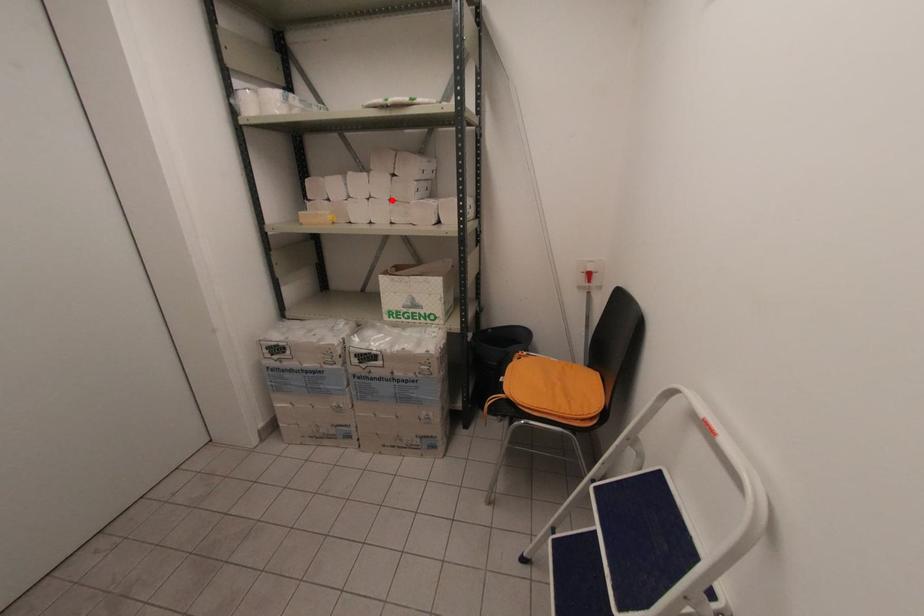
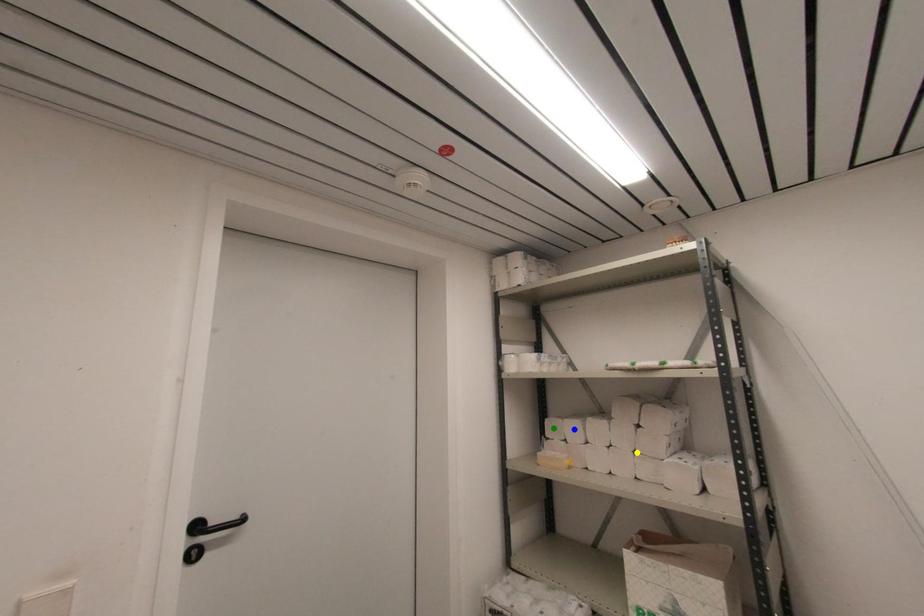
Question: I am providing you with two images of the same scene from different viewpoints. A red point is marked on the first image. You are given multiple points on the second image. Which point in image 2 represents the same 3d spot as the red point in image 1?

Choices:
 (A) blue point
 (B) green point
 (C) yellow point

Answer: (C)